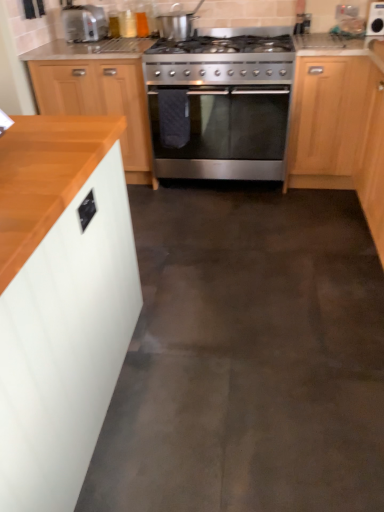
The width and height of the screenshot is (384, 512). Find the location of `free space in front of matte silver toaster at upper left`. free space in front of matte silver toaster at upper left is located at coordinates (82, 49).